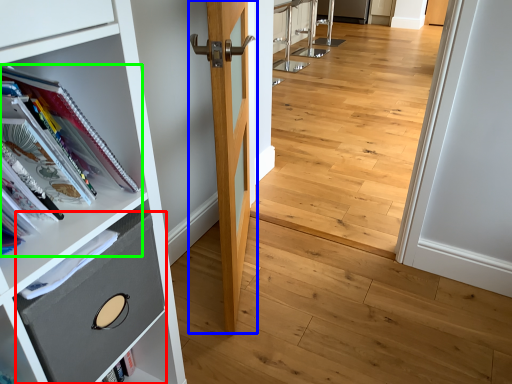
Question: Which object is positioned closest to drawer (highlighted by a red box)? Select from door (highlighted by a blue box) and book (highlighted by a green box).

Choices:
 (A) door
 (B) book

Answer: (B)